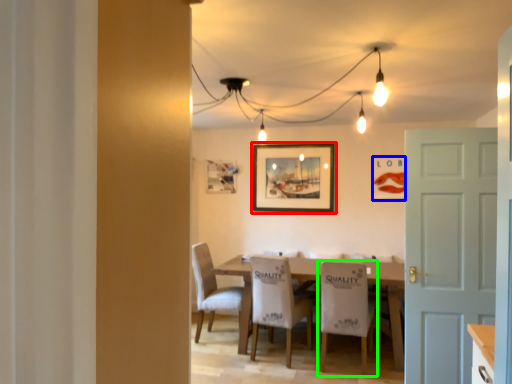
Question: Estimate the real-world distances between objects in this image. Which object is closer to picture frame (highlighted by a red box), picture frame (highlighted by a blue box) or chair (highlighted by a green box)?

Choices:
 (A) picture frame
 (B) chair

Answer: (A)